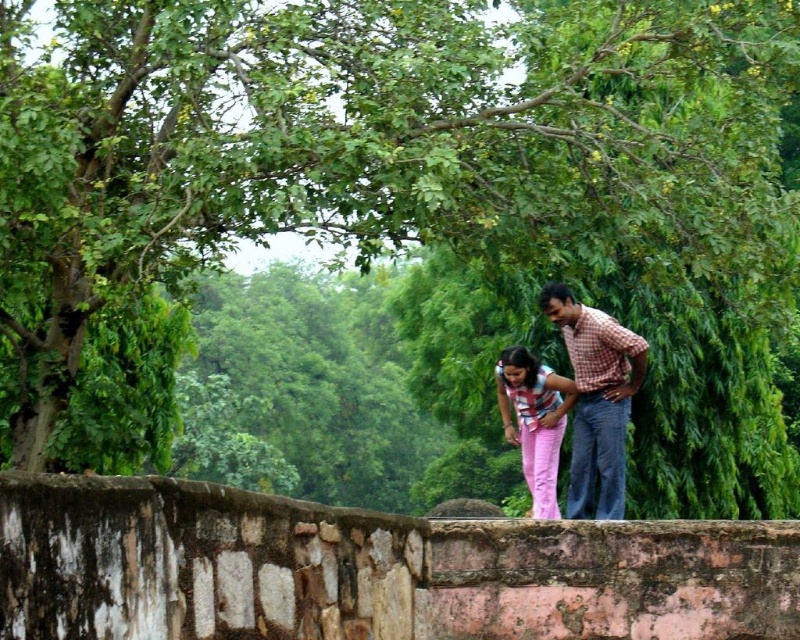
Is checkered fabric shirt at center thinner than striped fabric shirt at center?

In fact, checkered fabric shirt at center might be wider than striped fabric shirt at center.

Which is above, checkered fabric shirt at center or striped fabric shirt at center?

checkered fabric shirt at center is above.

Is point (552, 288) less distant than point (540, 388)?

No, it is not.

At what (x,y) coordinates should I click in order to perform the action: click on checkered fabric shirt at center. Please return your answer as a coordinate pair (x, y). The height and width of the screenshot is (640, 800). Looking at the image, I should click on (596, 401).